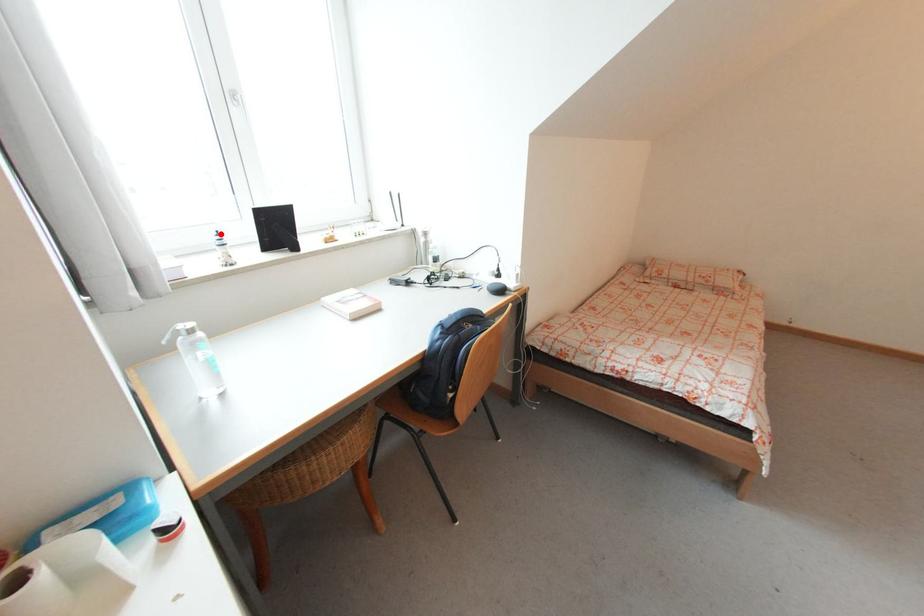
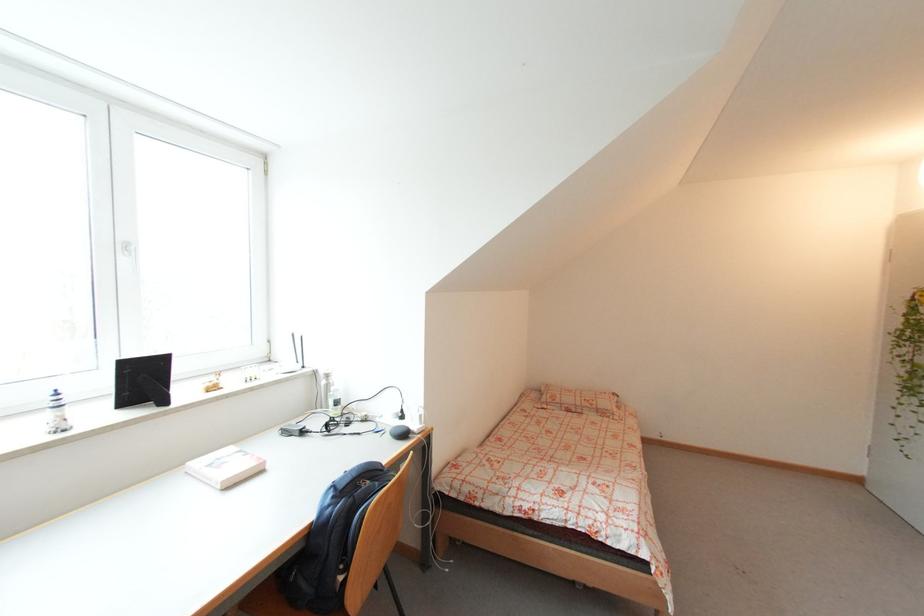
In the second image, find the point that corresponds to the highlighted location in the first image.

(58, 392)